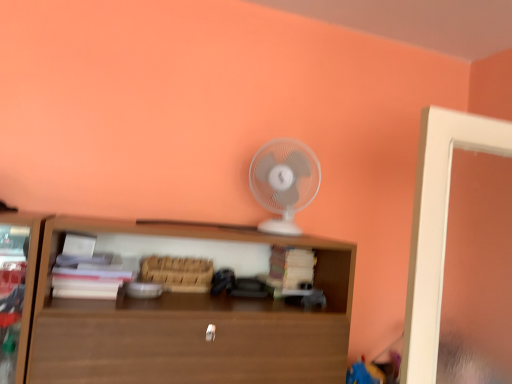
Question: Can you confirm if white plastic fan at upper center is taller than brown wooden shelf at center?

Choices:
 (A) no
 (B) yes

Answer: (A)

Question: Is white plastic fan at upper center outside brown wooden shelf at center?

Choices:
 (A) no
 (B) yes

Answer: (B)

Question: Could you tell me if white plastic fan at upper center is facing brown wooden shelf at center?

Choices:
 (A) no
 (B) yes

Answer: (A)

Question: Is white plastic fan at upper center beside brown wooden shelf at center?

Choices:
 (A) no
 (B) yes

Answer: (A)

Question: Is white plastic fan at upper center wider than brown wooden shelf at center?

Choices:
 (A) yes
 (B) no

Answer: (B)

Question: Is white plastic fan at upper center oriented away from brown wooden shelf at center?

Choices:
 (A) no
 (B) yes

Answer: (A)

Question: Can you confirm if brown wooden shelf at center is positioned to the right of white plastic fan at upper center?

Choices:
 (A) yes
 (B) no

Answer: (B)

Question: Considering the relative sizes of brown wooden shelf at center and white plastic fan at upper center in the image provided, is brown wooden shelf at center bigger than white plastic fan at upper center?

Choices:
 (A) no
 (B) yes

Answer: (B)

Question: From the image's perspective, would you say brown wooden shelf at center is positioned over white plastic fan at upper center?

Choices:
 (A) yes
 (B) no

Answer: (B)

Question: Is brown wooden shelf at center thinner than white plastic fan at upper center?

Choices:
 (A) yes
 (B) no

Answer: (B)

Question: From a real-world perspective, does brown wooden shelf at center sit lower than white plastic fan at upper center?

Choices:
 (A) yes
 (B) no

Answer: (A)

Question: Is brown wooden shelf at center touching white plastic fan at upper center?

Choices:
 (A) no
 (B) yes

Answer: (A)

Question: Considering the positions of point (337, 367) and point (289, 226), is point (337, 367) closer or farther from the camera than point (289, 226)?

Choices:
 (A) farther
 (B) closer

Answer: (B)